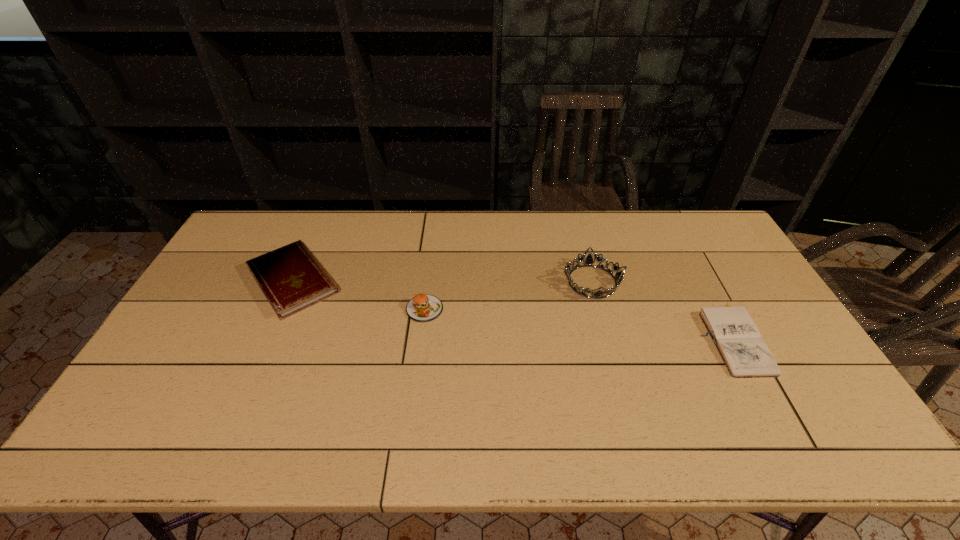
At what (x,y) coordinates should I click in order to perform the action: click on object at the far edge. Please return your answer as a coordinate pair (x, y). Looking at the image, I should click on (290, 277).

Find the location of `object located in the left edge section of the desktop`. object located in the left edge section of the desktop is located at coordinates (290, 277).

Where is `object located in the right edge section of the desktop`? object located in the right edge section of the desktop is located at coordinates [x=746, y=355].

Find the location of a particular element. The image size is (960, 540). object at the far left corner is located at coordinates (290, 277).

At what (x,y) coordinates should I click in order to perform the action: click on free space at the far edge. Please return your answer as a coordinate pair (x, y). Looking at the image, I should click on (376, 227).

In the image, there is a desktop. Identify the location of vacant space at the near edge. (236, 452).

Image resolution: width=960 pixels, height=540 pixels. Identify the location of vacant space at the right edge. (713, 276).

At what (x,y) coordinates should I click in order to perform the action: click on vacant space at the far left corner. Please return your answer as a coordinate pair (x, y). The image size is (960, 540). Looking at the image, I should click on (264, 228).

Where is `free region at the near right corner of the desktop`? Image resolution: width=960 pixels, height=540 pixels. free region at the near right corner of the desktop is located at coordinates (802, 421).

This screenshot has height=540, width=960. In order to click on empty space that is in between the tiara and the second tallest object in this screenshot , I will do `click(508, 295)`.